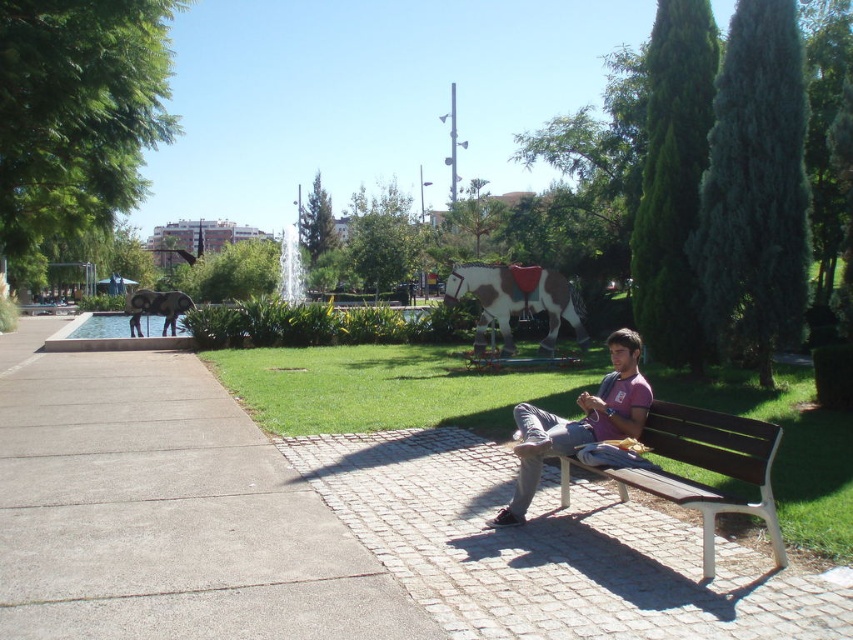
You are a park visitor who wants to sit down. You see the brown wooden bench at center and the light brown denim pants at center. Which object can you sit on?

The brown wooden bench at center has a larger size compared to light brown denim pants at center, so you can sit on the brown wooden bench at center.

You are planning to host a small gathering in the park and need to choose seating for guests. Based on the image, which bench between the paved stone bench at center and the brown wooden bench at center would accommodate more people?

The brown wooden bench at center occupies more space than the paved stone bench at center, so it can accommodate more people.

You are a park visitor who wants to sit on the bench closest to the fountain. Which bench should you choose between the paved stone bench at center and the brown wooden bench at center?

The paved stone bench at center is to the left of brown wooden bench at center. Since the fountain is near the center of the image, the brown wooden bench at center is closer to the fountain and should be chosen.